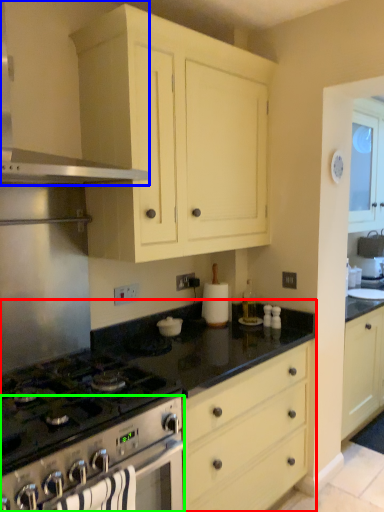
Question: Which object is positioned closest to countertop (highlighted by a red box)? Select from kitchen appliance (highlighted by a blue box) and oven (highlighted by a green box).

Choices:
 (A) kitchen appliance
 (B) oven

Answer: (B)